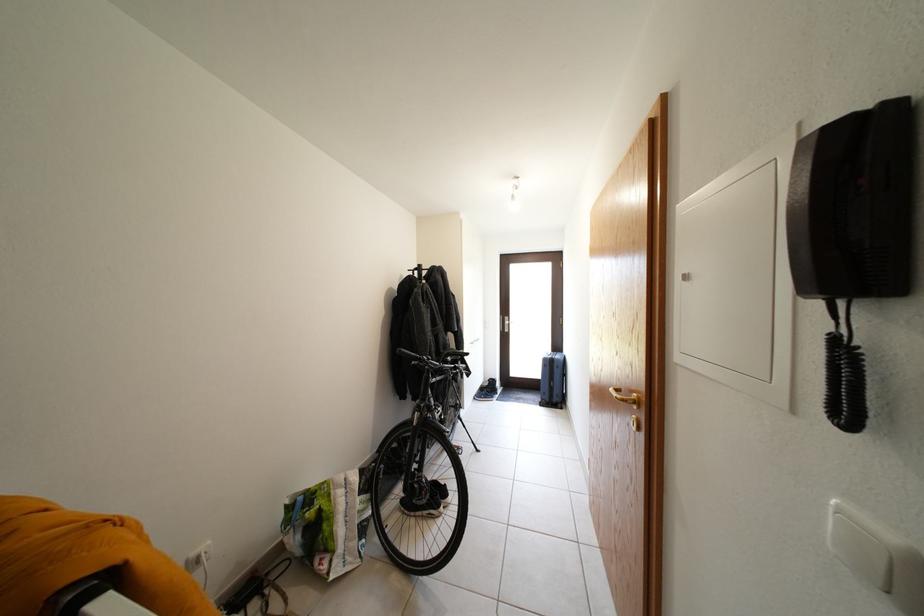
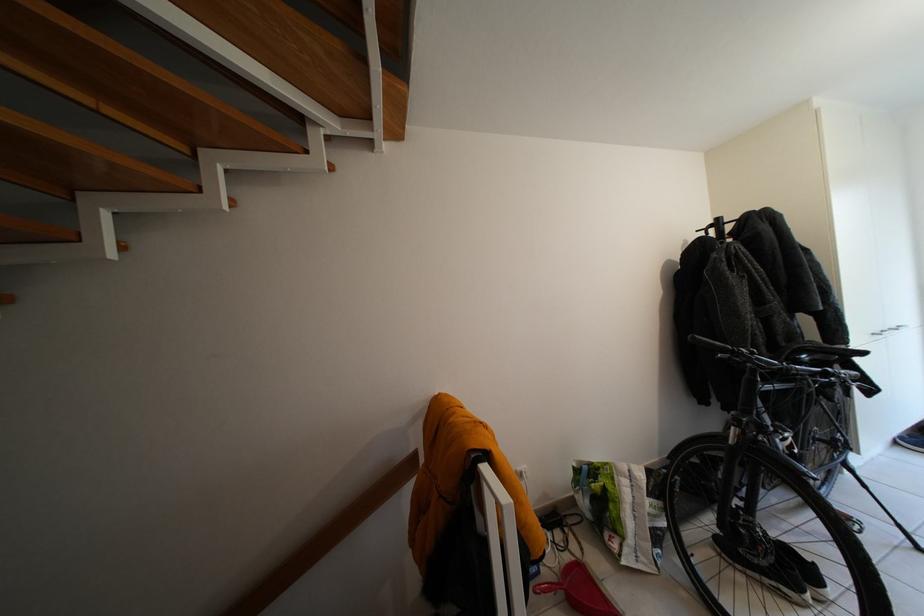
Question: The images are taken continuously from a first-person perspective. In which direction is your viewpoint rotating?

Choices:
 (A) Left
 (B) Right
 (C) Up
 (D) Down

Answer: (A)